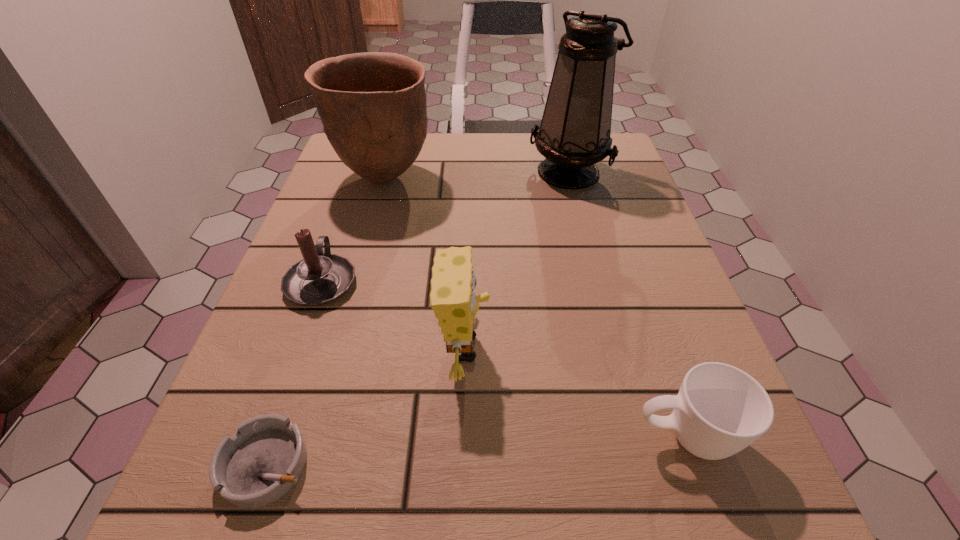
In order to click on vacant region located 0.210m on the side of the fourth tallest object with the handle loop in this screenshot , I will do `click(353, 194)`.

This screenshot has width=960, height=540. I want to click on vacant space situated 0.270m on the side of the fourth tallest object with the handle loop, so click(358, 179).

Find the location of a particular element. The height and width of the screenshot is (540, 960). free space located 0.210m on the side of the fourth tallest object with the handle loop is located at coordinates (353, 194).

Where is `vacant space located 0.140m with the handle on the side of the cup`? The image size is (960, 540). vacant space located 0.140m with the handle on the side of the cup is located at coordinates (530, 437).

Where is `free space located 0.320m with the handle on the side of the cup`? The image size is (960, 540). free space located 0.320m with the handle on the side of the cup is located at coordinates (398, 437).

I want to click on vacant space located 0.070m with the handle on the side of the cup, so click(x=581, y=437).

Locate an element on the screen. The width and height of the screenshot is (960, 540). free location located 0.270m on the right of the ashtray is located at coordinates (517, 464).

I want to click on oil lamp that is at the far edge, so click(x=574, y=135).

This screenshot has width=960, height=540. I want to click on pottery situated at the far edge, so click(372, 105).

The width and height of the screenshot is (960, 540). Find the location of `object located in the near edge section of the desktop`. object located in the near edge section of the desktop is located at coordinates (x=263, y=460).